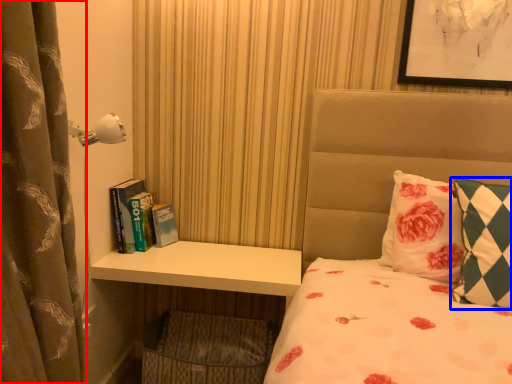
Question: Which object is further to the camera taking this photo, curtain (highlighted by a red box) or pillow (highlighted by a blue box)?

Choices:
 (A) curtain
 (B) pillow

Answer: (B)